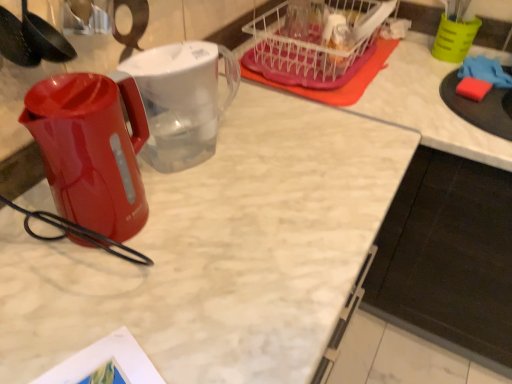
Locate an element on the screen. free space between glossy plastic kettle at left and green plastic cup at upper right is located at coordinates (324, 118).